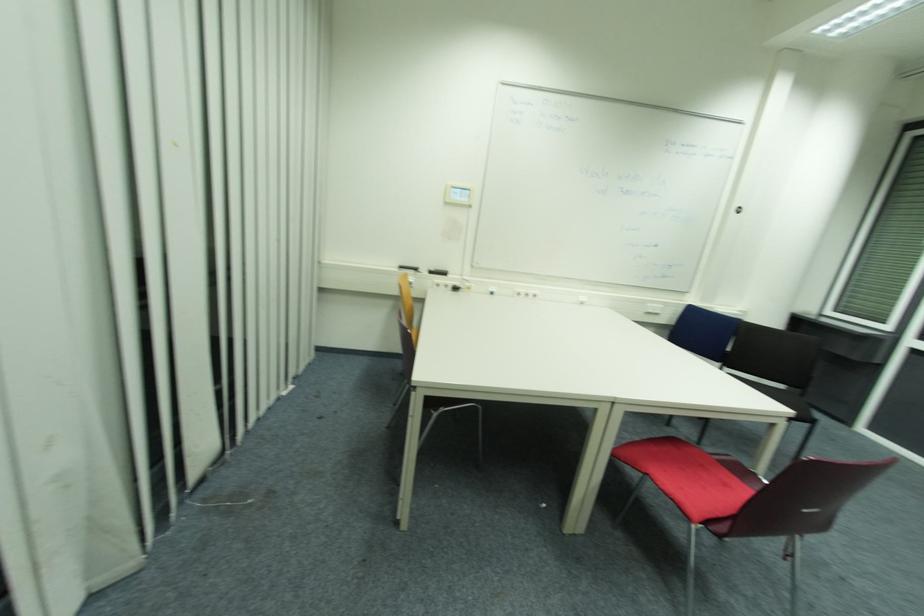
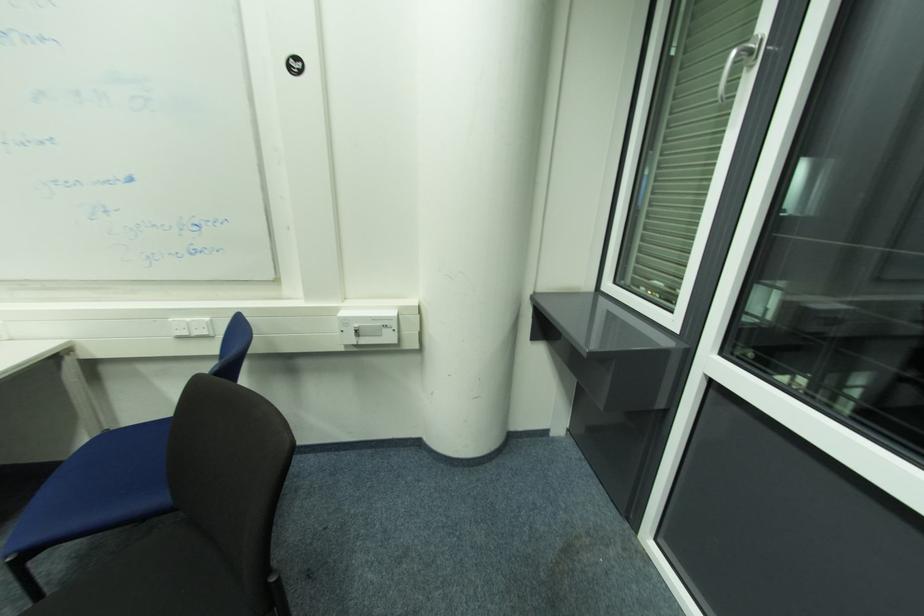
The point at (658, 306) is marked in the first image. Where is the corresponding point in the second image?

(191, 320)